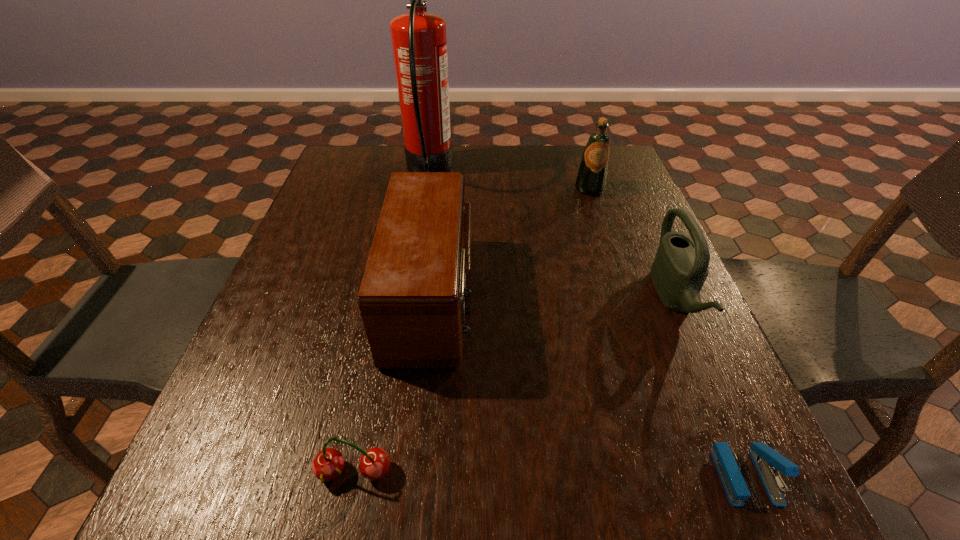
Where is `object positioned at the far right corner`? object positioned at the far right corner is located at coordinates (591, 179).

This screenshot has height=540, width=960. Find the location of `object that is at the near right corner`. object that is at the near right corner is located at coordinates (767, 461).

In the image, there is a desktop. Find the location of `vacant space at the far edge`. vacant space at the far edge is located at coordinates (558, 172).

In the image, there is a desktop. Identify the location of free region at the near edge. (503, 469).

Identify the location of free spot at the left edge of the desktop. The image size is (960, 540). (319, 227).

Locate an element on the screen. Image resolution: width=960 pixels, height=540 pixels. vacant space at the right edge of the desktop is located at coordinates [663, 315].

In the image, there is a desktop. Where is `vacant space at the far left corner`? vacant space at the far left corner is located at coordinates (348, 185).

Find the location of a particular element. This screenshot has width=960, height=540. free space at the far right corner is located at coordinates (636, 186).

You are a GUI agent. You are given a task and a screenshot of the screen. Output one action in this format:
    pyautogui.click(x=<x>, y=<y>)
    Task: Click on the free space between the stapler and the radio receiver
    
    Given the screenshot: What is the action you would take?
    pyautogui.click(x=588, y=386)

The width and height of the screenshot is (960, 540). I want to click on empty space that is in between the fifth tallest object and the third object from right to left, so click(x=472, y=330).